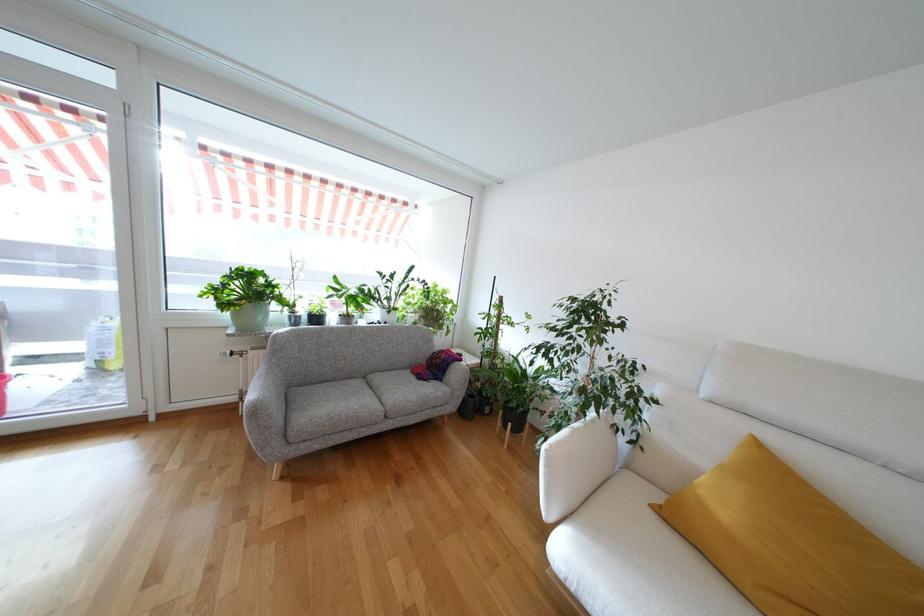
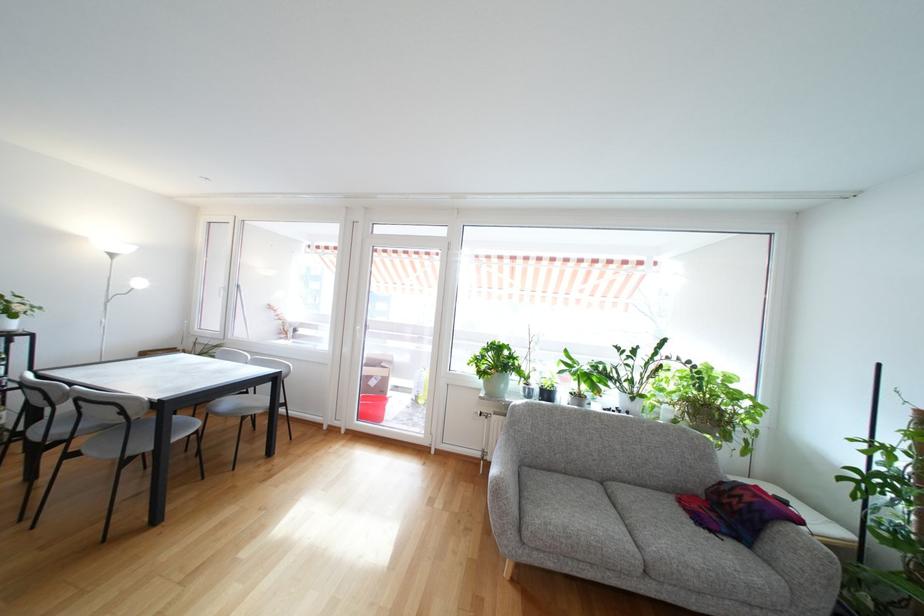
Question: How did the camera likely rotate?

Choices:
 (A) Left
 (B) Right
 (C) Up
 (D) Down

Answer: (A)